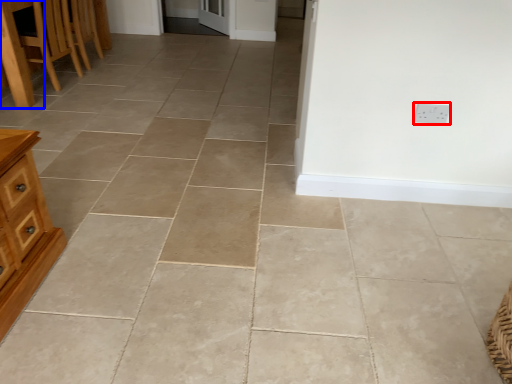
Question: Which of the following is the farthest to the observer, electric outlet (highlighted by a red box) or table (highlighted by a blue box)?

Choices:
 (A) electric outlet
 (B) table

Answer: (B)